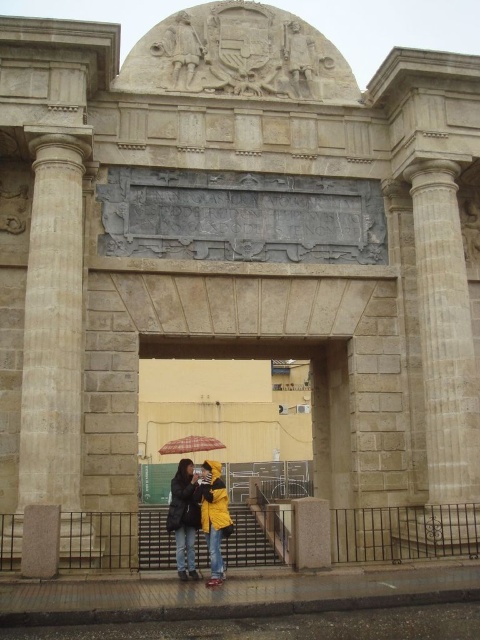
You are standing under the grand stone archway and notice the yellow matte umbrella at center and the beige stone column at right. Which object has a larger width?

The yellow matte umbrella at center might be wider than beige stone column at right according to the description.

You are standing in front of the grand stone archway and notice a yellow matte umbrella at center and a beige stone column at right. Which object is bigger?

The yellow matte umbrella at center is larger in size compared to the beige stone column at right.

You are standing in front of the grand stone archway and see a yellow matte umbrella at center and a yellow matte jacket at center. Which one is located to the right side?

The yellow matte umbrella at center is positioned on the right side of the yellow matte jacket at center.